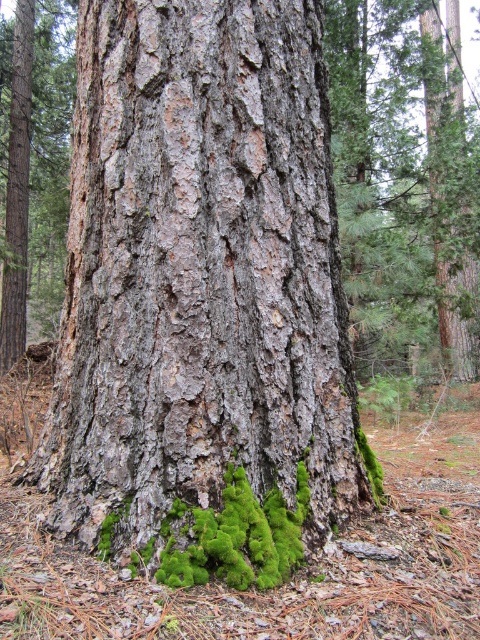
Does smooth bark tree at center have a larger size compared to green fuzzy moss at lower center?

Yes, smooth bark tree at center is bigger than green fuzzy moss at lower center.

Does smooth bark tree at center have a lesser width compared to green fuzzy moss at lower center?

No.

Which is in front, point (352, 321) or point (247, 488)?

Point (247, 488)

I want to click on smooth bark tree at center, so (x=403, y=189).

Does gray rough bark tree trunk at center have a greater width compared to green fuzzy moss at lower center?

Correct, the width of gray rough bark tree trunk at center exceeds that of green fuzzy moss at lower center.

Is point (307, 188) farther from camera compared to point (199, 518)?

Yes.

Does point (337, 388) come in front of point (238, 570)?

No.

Where is `gray rough bark tree trunk at center`? The width and height of the screenshot is (480, 640). gray rough bark tree trunk at center is located at coordinates [199, 269].

Can you confirm if gray rough bark tree trunk at center is positioned above smooth bark tree at center?

Incorrect, gray rough bark tree trunk at center is not positioned above smooth bark tree at center.

Which is below, gray rough bark tree trunk at center or smooth bark tree at center?

gray rough bark tree trunk at center is below.

Does point (149, 321) come farther from viewer compared to point (394, 177)?

No, (149, 321) is in front of (394, 177).

Find the location of `gray rough bark tree trunk at center`. gray rough bark tree trunk at center is located at coordinates (199, 269).